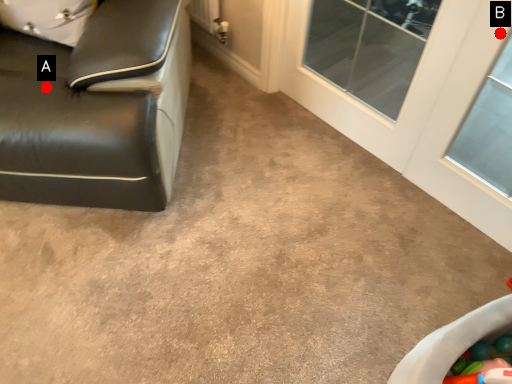
Question: Two points are circled on the image, labeled by A and B beside each circle. Which point is further to the camera?

Choices:
 (A) A is further
 (B) B is further

Answer: (A)